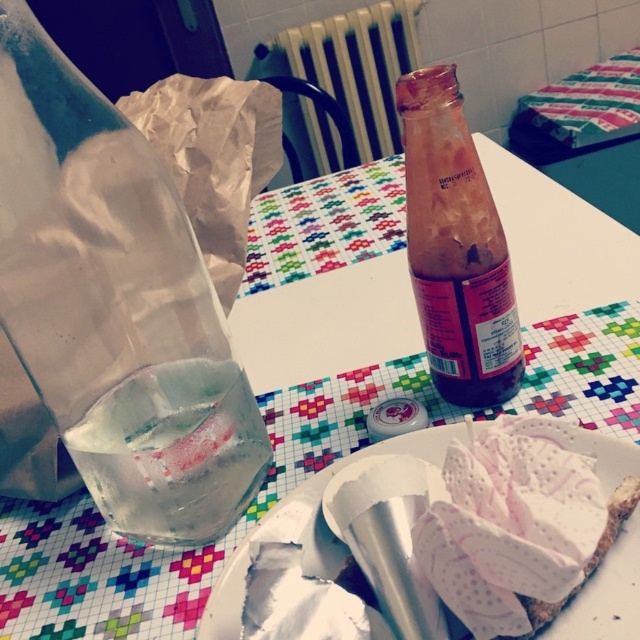
You are setting up a table for a party and need to place two bottles on it. The clear glass bottle at left and the translucent glass bottle at center are both candidates. Which one has a larger width?

The clear glass bottle at left has a larger width than the translucent glass bottle at center according to the description provided.

In the scene shown: You are setting up a small snack area on the table and need to place a snack bowl between the clear glass bottle at left and the white paper plate at lower right. Can the bowl fit in the space between them if the bowl has a diameter of 7 centimeters?

The distance between the clear glass bottle at left and the white paper plate at lower right is 8.15 centimeters. Since the bowl has a diameter of 7 centimeters, which is smaller than the available space, the bowl can fit between them.

You are a guest at this table and want to place your phone on the clear glass bottle at left or the metallic radiator at upper center. Which one is a better choice if you want to avoid your phone getting too hot?

The clear glass bottle at left is thinner than the metallic radiator at upper center, so the metallic radiator at upper center is thicker. Since metal conducts heat better than glass, the metallic radiator at upper center might get hotter. Therefore, placing the phone on the clear glass bottle at left would be better to avoid excessive heat.